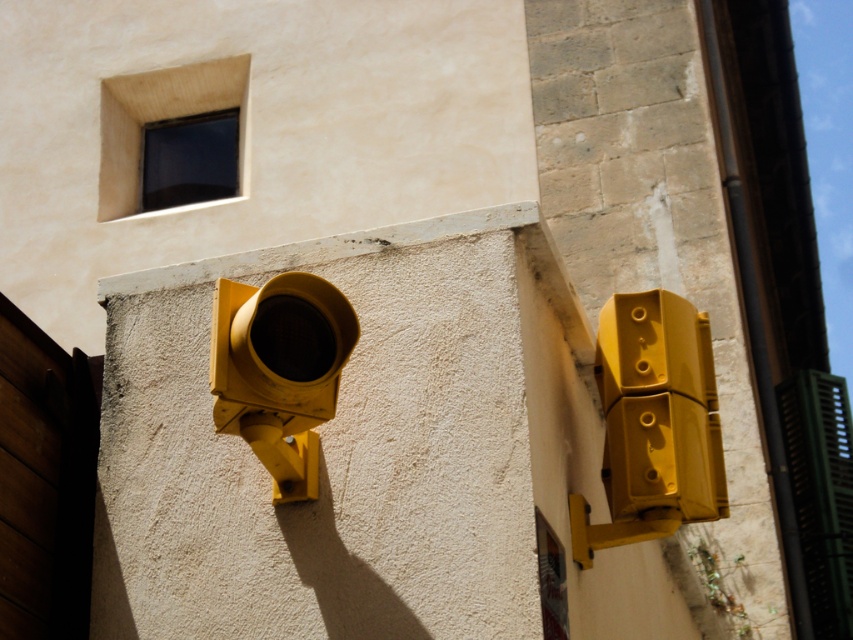
Does matte yellow traffic light at right have a greater width compared to matte yellow traffic light at left?

Yes.

Does point (666, 374) lie in front of point (239, 417)?

No, it is behind (239, 417).

Is point (682, 468) farther from viewer compared to point (253, 384)?

Yes, it is behind point (253, 384).

Find the location of a particular element. This screenshot has width=853, height=640. matte yellow traffic light at right is located at coordinates (653, 422).